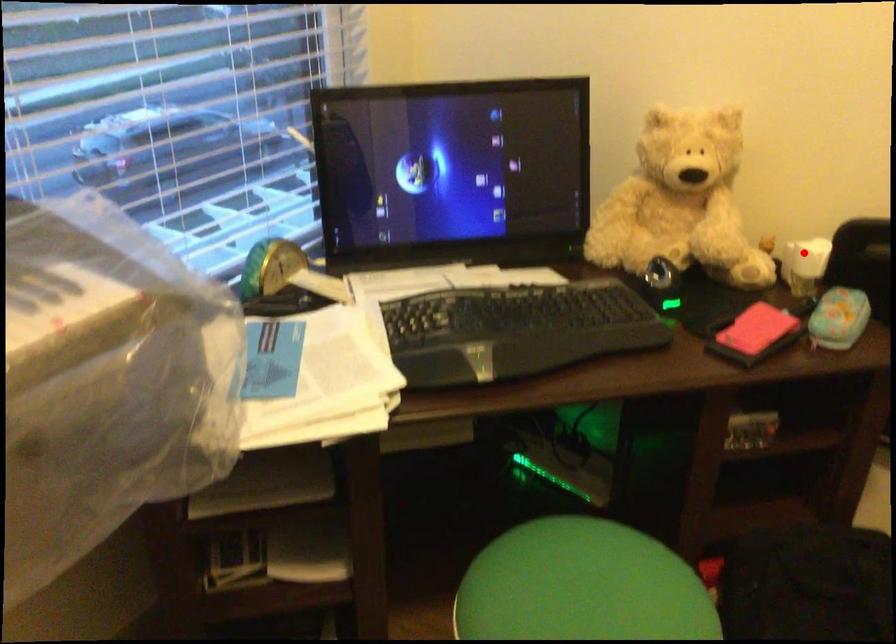
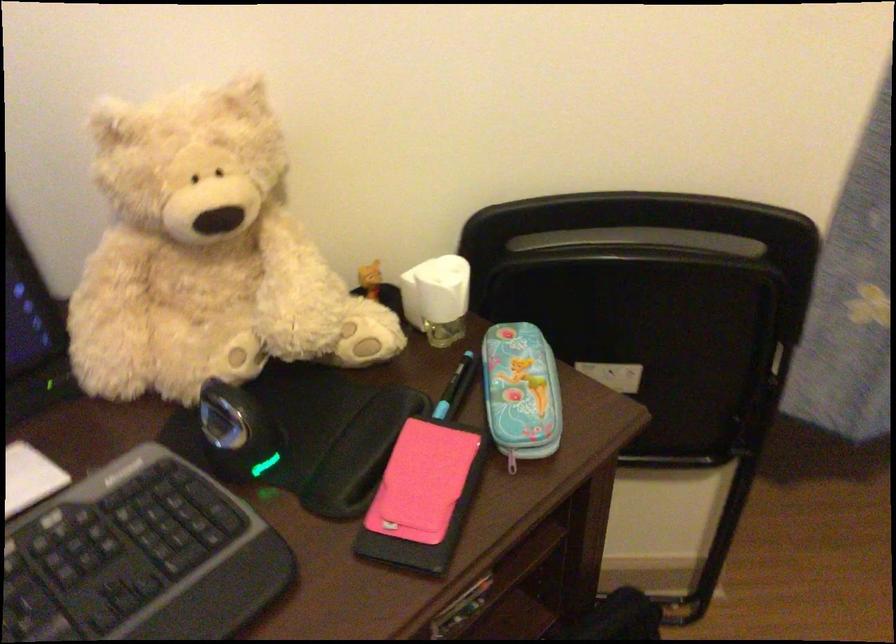
Question: I am providing you with two images of the same scene from different viewpoints. In image1, a red point is highlighted. Considering the same 3D point in image2, which of the following is correct?

Choices:
 (A) It is closer
 (B) It is farther

Answer: (A)